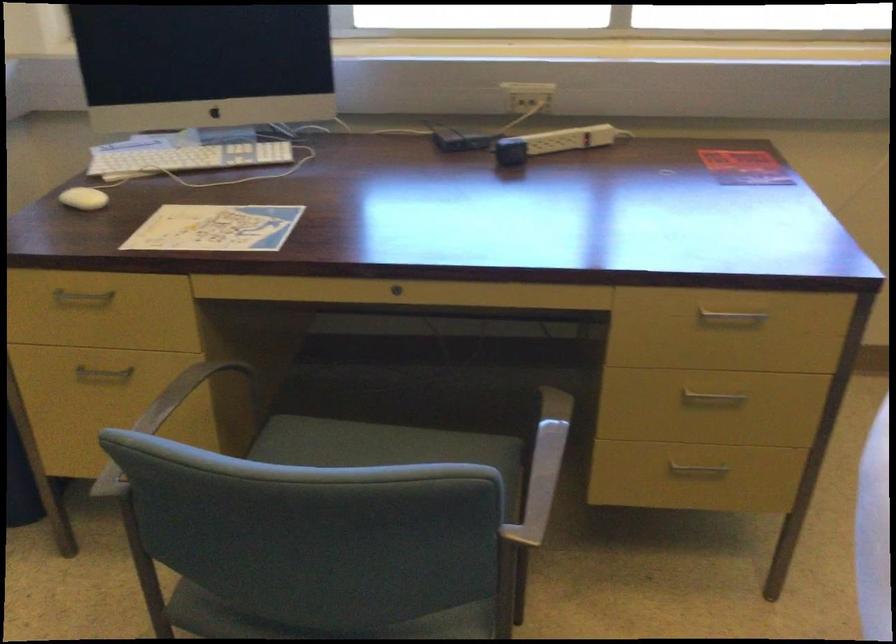
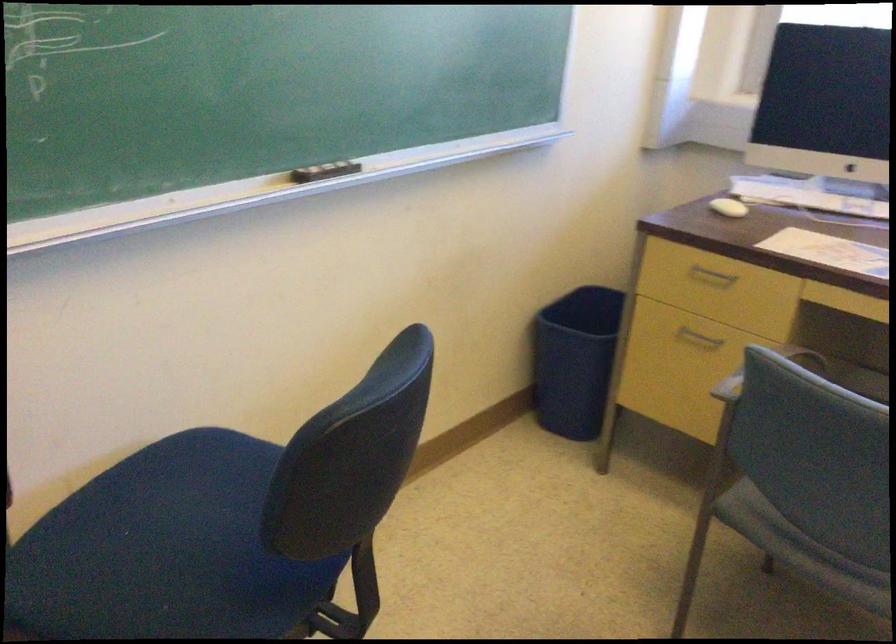
Locate, in the second image, the point that corresponds to the point at 82,307 in the first image.

(711, 277)